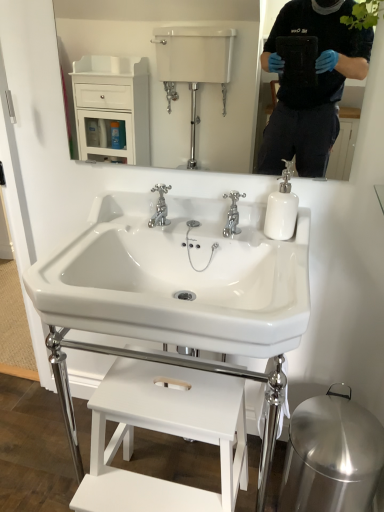
Question: Is chrome metallic faucet at center taller than white glossy sink at center?

Choices:
 (A) yes
 (B) no

Answer: (B)

Question: Is there a large distance between chrome metallic faucet at center and white glossy sink at center?

Choices:
 (A) yes
 (B) no

Answer: (B)

Question: Does chrome metallic faucet at center touch white glossy sink at center?

Choices:
 (A) no
 (B) yes

Answer: (A)

Question: From a real-world perspective, is chrome metallic faucet at center on white glossy sink at center?

Choices:
 (A) yes
 (B) no

Answer: (A)

Question: Does chrome metallic faucet at center have a lesser width compared to white glossy sink at center?

Choices:
 (A) no
 (B) yes

Answer: (B)

Question: Is chrome metallic faucet at center not inside white glossy sink at center?

Choices:
 (A) yes
 (B) no

Answer: (B)

Question: Considering the relative sizes of white glossy sink at center and white glossy soap dispenser at upper right in the image provided, is white glossy sink at center smaller than white glossy soap dispenser at upper right?

Choices:
 (A) yes
 (B) no

Answer: (B)

Question: From the image's perspective, is white glossy sink at center above white glossy soap dispenser at upper right?

Choices:
 (A) yes
 (B) no

Answer: (B)

Question: Is white glossy sink at center oriented towards white glossy soap dispenser at upper right?

Choices:
 (A) no
 (B) yes

Answer: (A)

Question: From a real-world perspective, is white glossy sink at center located beneath white glossy soap dispenser at upper right?

Choices:
 (A) yes
 (B) no

Answer: (A)

Question: Can you confirm if white glossy sink at center is positioned to the left of white glossy soap dispenser at upper right?

Choices:
 (A) no
 (B) yes

Answer: (B)

Question: Is white glossy sink at center behind white glossy soap dispenser at upper right?

Choices:
 (A) no
 (B) yes

Answer: (A)

Question: Can you confirm if white glossy sink at center is smaller than chrome metallic faucet at center?

Choices:
 (A) no
 (B) yes

Answer: (A)